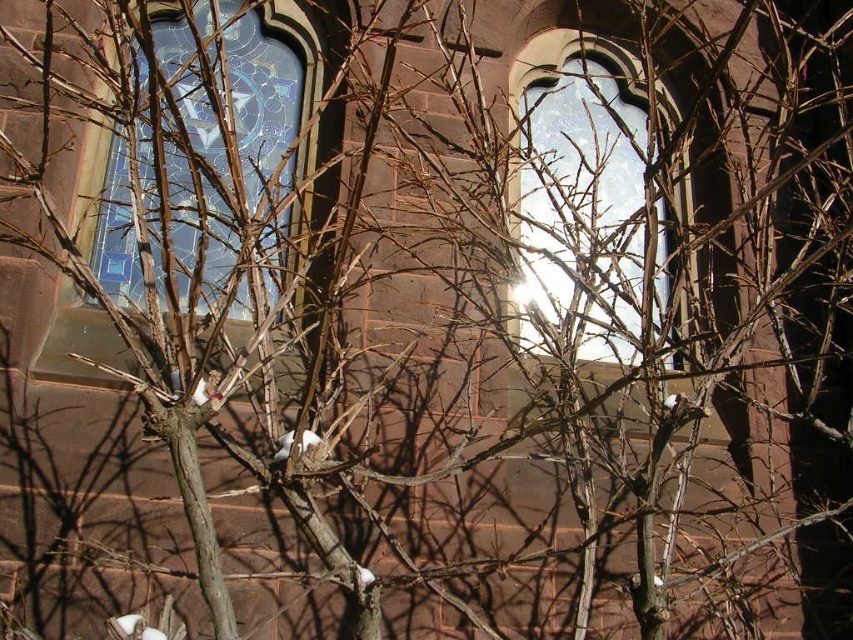
You are standing in front of the building with the brick facade and arched windows. You notice a point at coordinates (585, 198). Based on the scene description, can you determine if this point is located on the clear glass window at center or on the textured brick facade?

The point at coordinates (585, 198) is on the clear glass window at center according to the provided information.

In the scene shown: You are standing in front of the building with arched windows and snow on the branches. There are two points marked on the image. Which point is closer to you, point (552, 243) or point (218, 253)?

Point (218, 253) is closer to you because it is less further to the camera than point (552, 243).

You are an architect assessing the building facade. You need to determine which window, the clear glass window at center or the stained glass window at upper left, has a greater surface area for natural light. Based on the description, which one allows more light?

The clear glass window at center has a larger size than the stained glass window at upper left, so it allows more natural light.